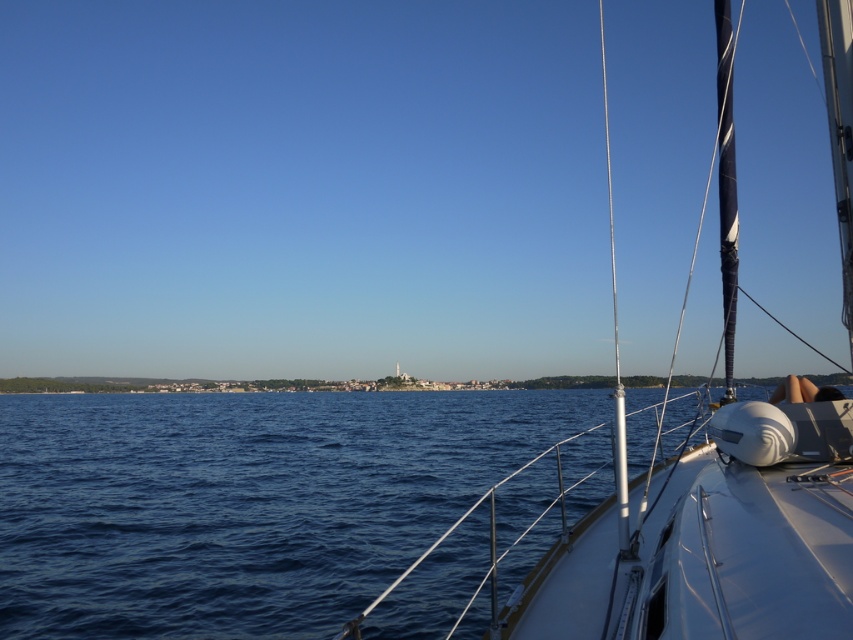
Question: Which object is farther from the camera taking this photo?

Choices:
 (A) black textured mast at right
 (B) silver/metallic mast at right
 (C) white glossy sailboat at center

Answer: (A)

Question: Can you confirm if blue water at center is smaller than silver/metallic mast at right?

Choices:
 (A) yes
 (B) no

Answer: (A)

Question: Estimate the real-world distances between objects in this image. Which object is closer to the white glossy sailboat at center?

Choices:
 (A) black textured mast at right
 (B) blue water at center
 (C) silver/metallic mast at right

Answer: (C)

Question: Which object is farther from the camera taking this photo?

Choices:
 (A) white glossy sailboat at center
 (B) silver/metallic mast at right
 (C) blue water at center
 (D) black textured mast at right

Answer: (D)

Question: Does blue water at center appear under black textured mast at right?

Choices:
 (A) no
 (B) yes

Answer: (B)

Question: Can you confirm if white glossy sailboat at center is positioned above silver/metallic mast at right?

Choices:
 (A) no
 (B) yes

Answer: (A)